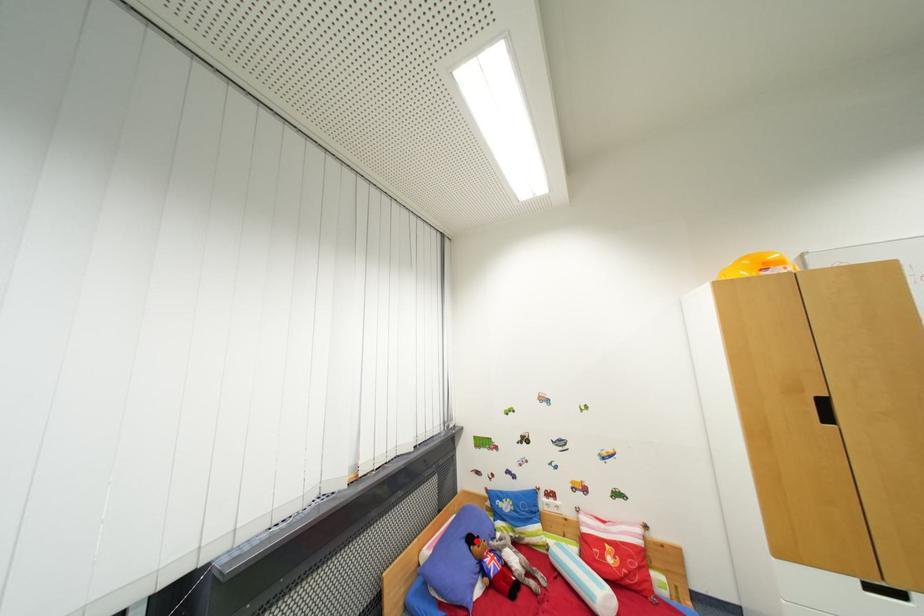
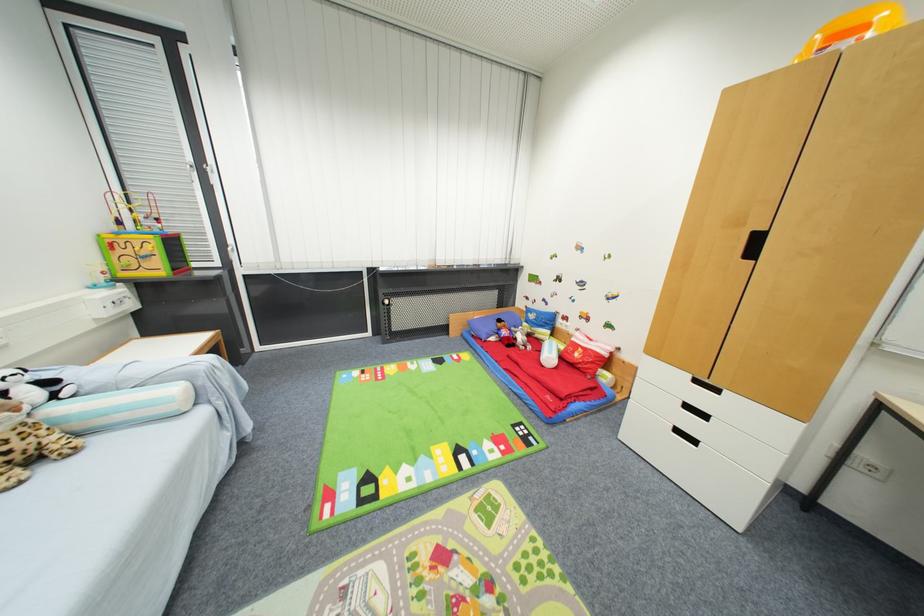
Question: I am providing you with two images of the same scene from different viewpoints. Given a red point in image1, look at the same physical point in image2. Is it:

Choices:
 (A) Closer to the viewpoint
 (B) Farther from the viewpoint

Answer: (B)